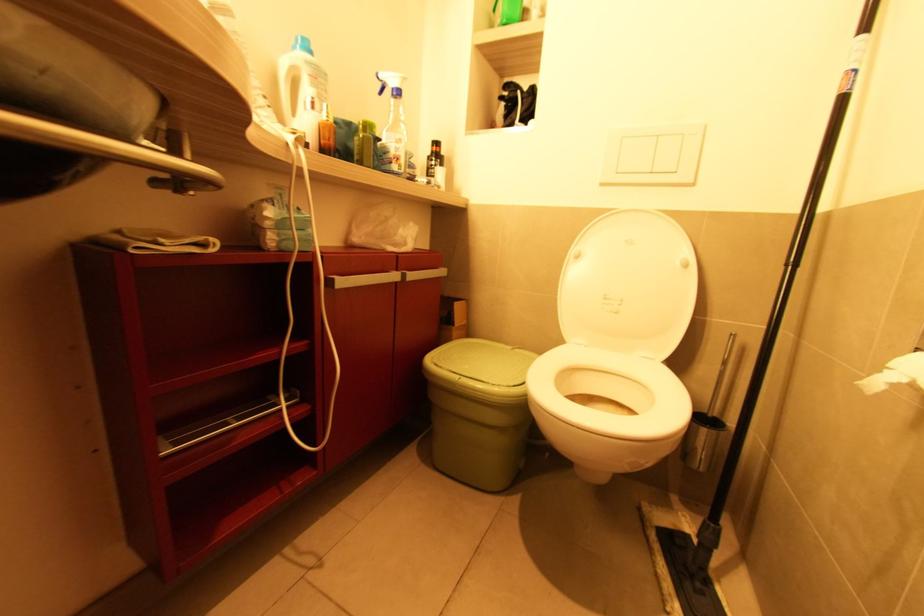
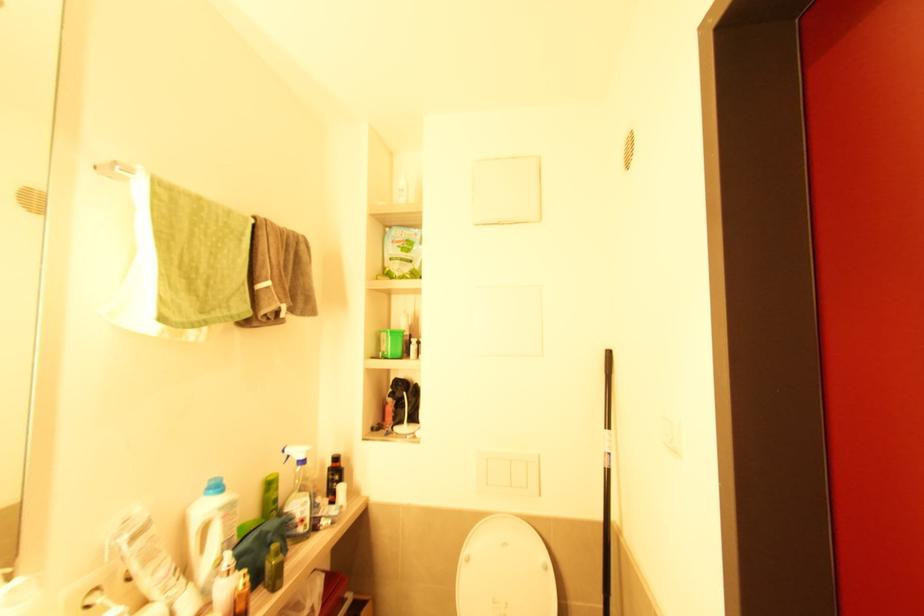
The point at [331,119] is marked in the first image. Where is the corresponding point in the second image?

(247, 585)